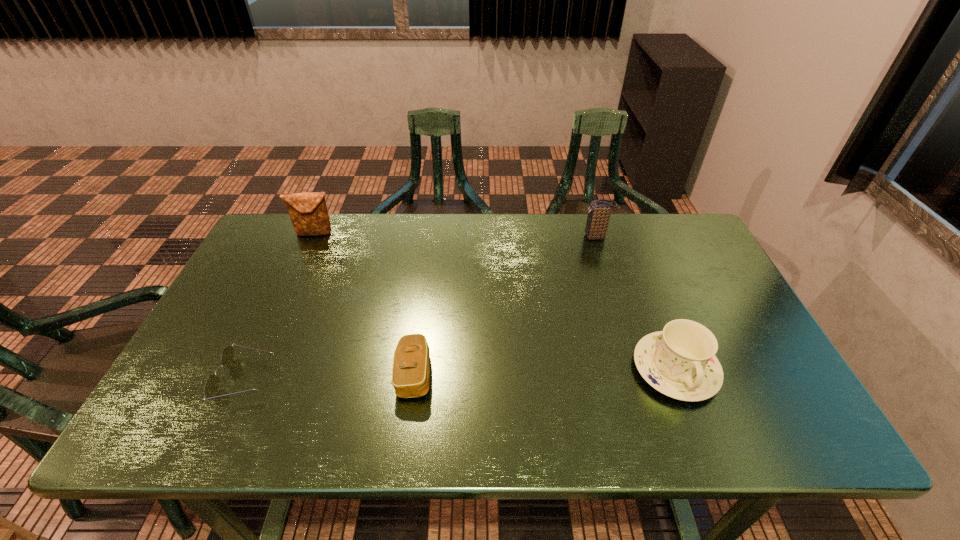
I want to click on the leftmost clutch bag, so tap(308, 212).

Locate an element on the screen. The height and width of the screenshot is (540, 960). the rightmost clutch bag is located at coordinates (599, 213).

In order to click on the third shortest object in this screenshot , I will do `click(680, 362)`.

Where is `the third object from right to left`? The width and height of the screenshot is (960, 540). the third object from right to left is located at coordinates (411, 362).

Find the location of a particular element. the nearest clutch bag is located at coordinates pyautogui.click(x=411, y=362).

Identify the location of the shortest object. (211, 388).

Where is `vacant space situated on the open side of the leftmost clutch bag`? Image resolution: width=960 pixels, height=540 pixels. vacant space situated on the open side of the leftmost clutch bag is located at coordinates (293, 285).

What are the coordinates of `free space located 0.190m with the zip open on the rightmost clutch bag` in the screenshot? It's located at (523, 237).

Identify the location of vacant space situated with the zip open on the rightmost clutch bag. The width and height of the screenshot is (960, 540). pyautogui.click(x=508, y=237).

Find the location of a particular element. free space located with the zip open on the rightmost clutch bag is located at coordinates (499, 237).